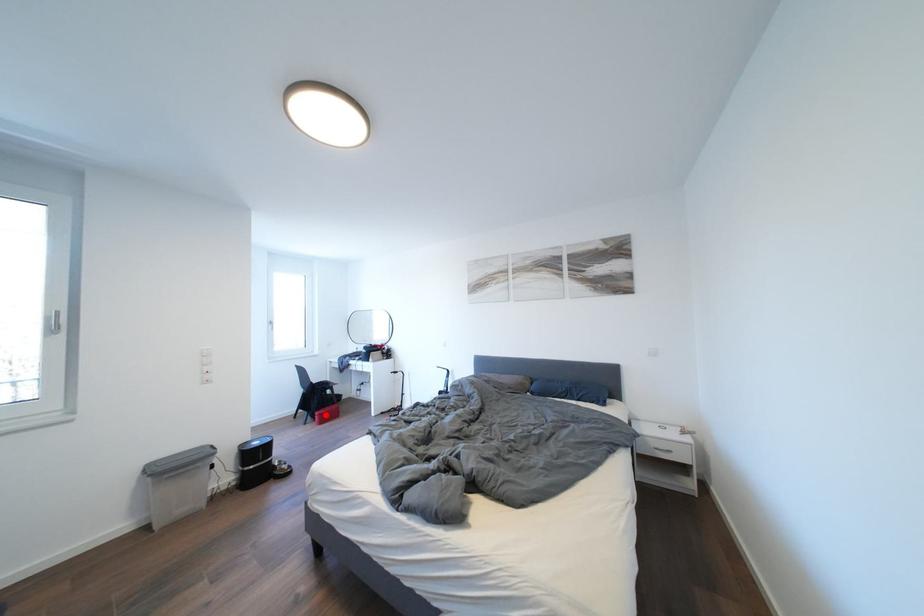
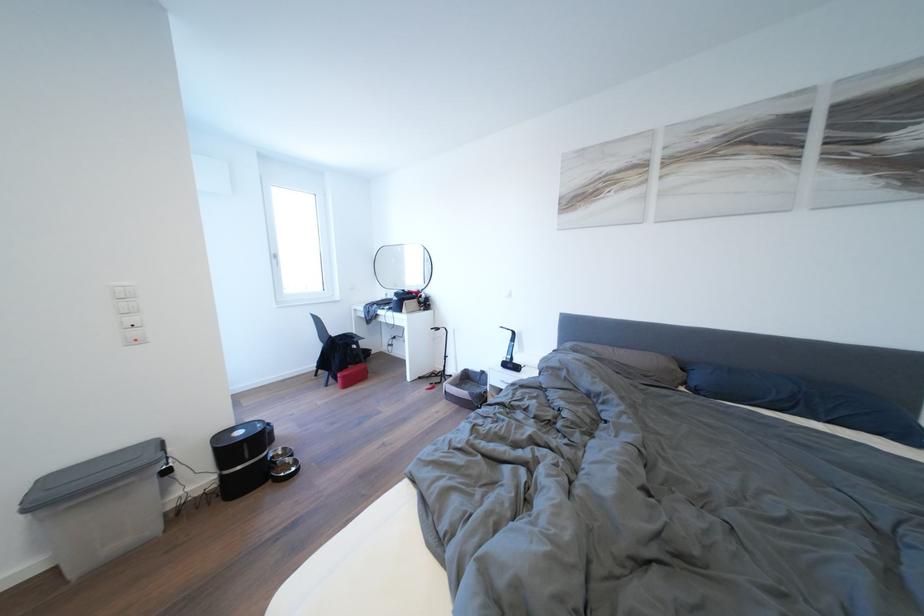
Question: I am providing you with two images of the same scene from different viewpoints. A red point is marked on the first image. At the location where the point appears in image 1, is it still visible in image 2?

Choices:
 (A) Yes
 (B) No

Answer: (A)